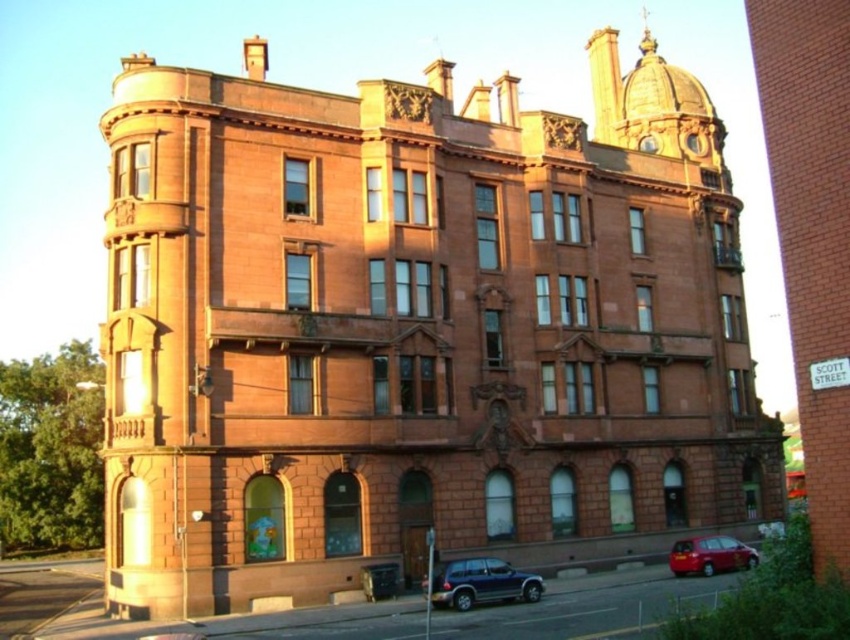
Question: In this image, where is satin black suv at lower center located relative to shiny red car at lower right?

Choices:
 (A) above
 (B) below

Answer: (A)

Question: Is the position of satin black suv at lower center less distant than that of shiny red car at lower right?

Choices:
 (A) yes
 (B) no

Answer: (A)

Question: Among these objects, which one is farthest from the camera?

Choices:
 (A) satin black suv at lower center
 (B) shiny red car at lower right

Answer: (B)

Question: Is satin black suv at lower center below shiny red car at lower right?

Choices:
 (A) no
 (B) yes

Answer: (A)

Question: Which point is farther to the camera?

Choices:
 (A) (707, 573)
 (B) (462, 605)

Answer: (A)